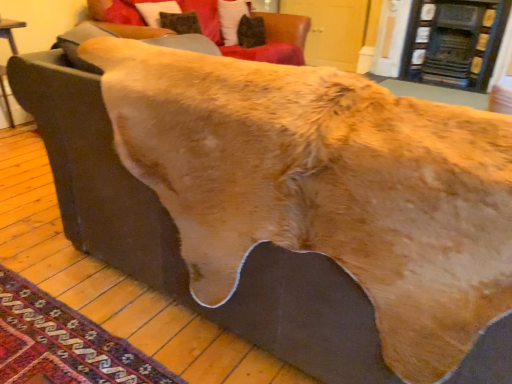
Question: From the image's perspective, is velvet dark brown pillow at upper center positioned above or below fur-like fabric at upper center?

Choices:
 (A) below
 (B) above

Answer: (B)

Question: In the image, is velvet dark brown pillow at upper center on the left side or the right side of fur-like fabric at upper center?

Choices:
 (A) right
 (B) left

Answer: (A)

Question: Which object is positioned closest to the velvet dark brown pillow at upper center?

Choices:
 (A) carpeted rug at lower left
 (B) fur-like fabric at upper center

Answer: (B)

Question: Which is nearer to the carpeted rug at lower left?

Choices:
 (A) fur-like fabric at upper center
 (B) velvet dark brown pillow at upper center

Answer: (A)